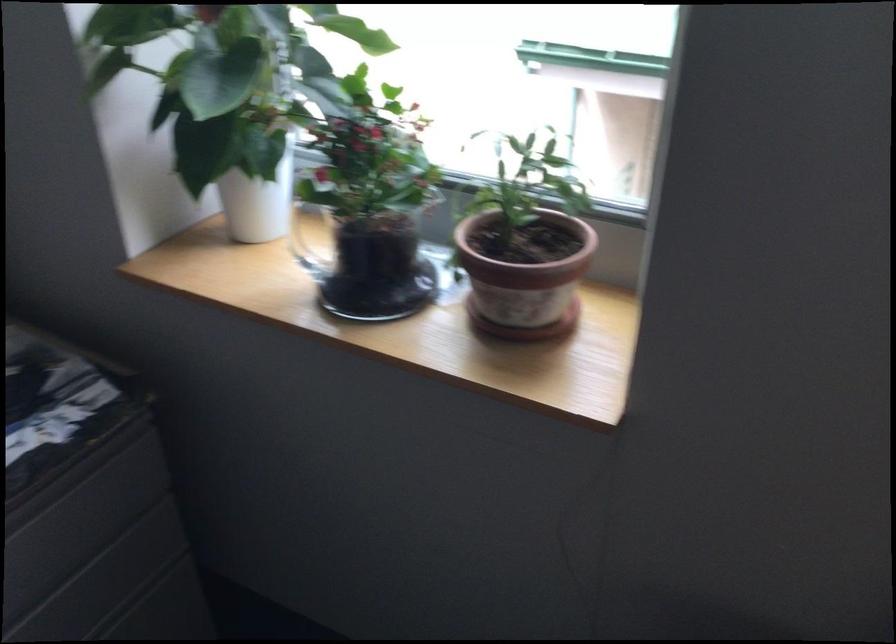
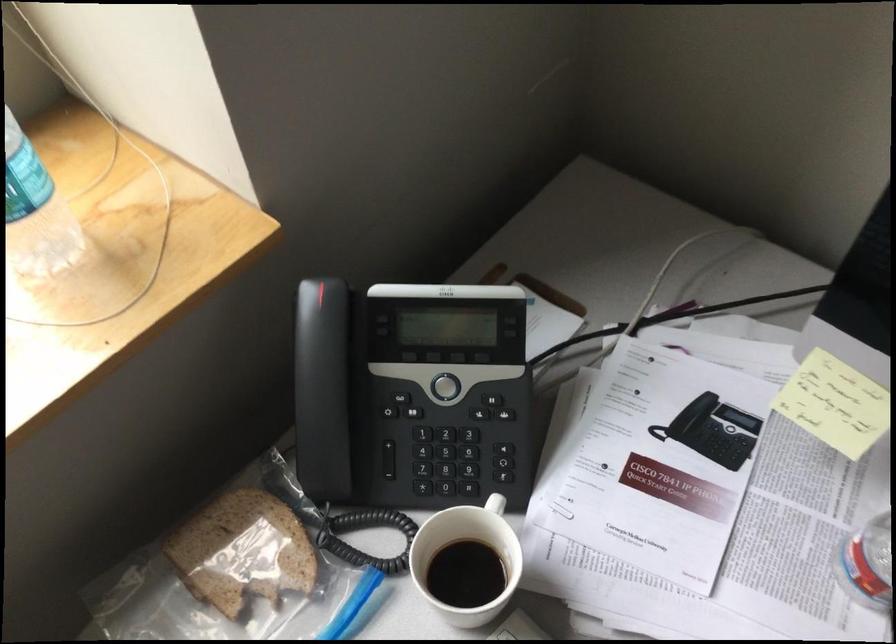
The images are taken continuously from a first-person perspective. In which direction is your viewpoint rotating?

The camera rotated toward right-down.